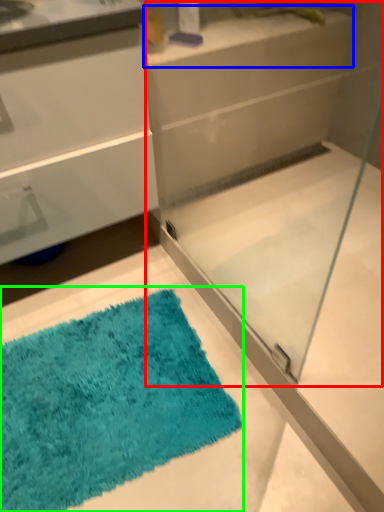
Question: Which is farther away from glass box (highlighted by a red box)? counter top (highlighted by a blue box) or bath mat (highlighted by a green box)?

Choices:
 (A) counter top
 (B) bath mat

Answer: (B)